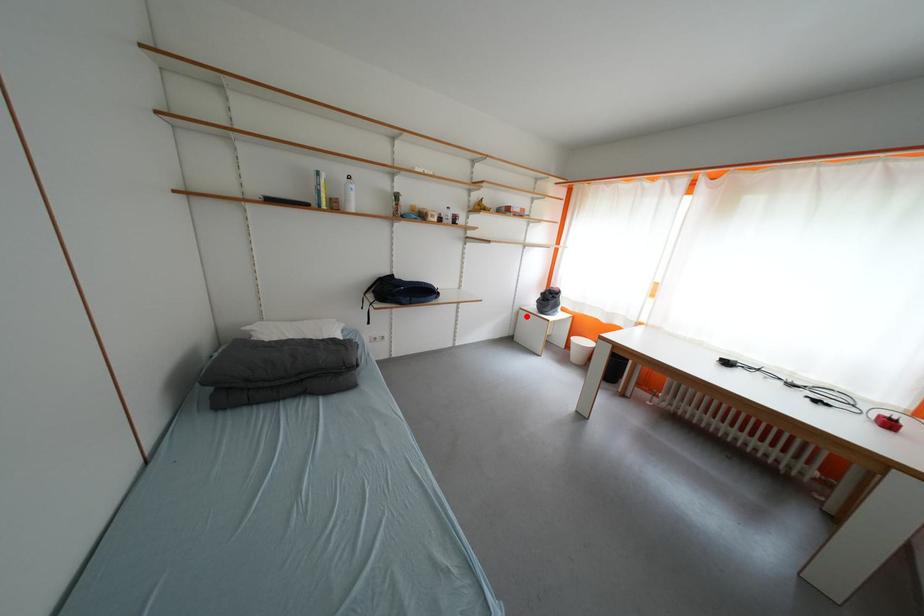
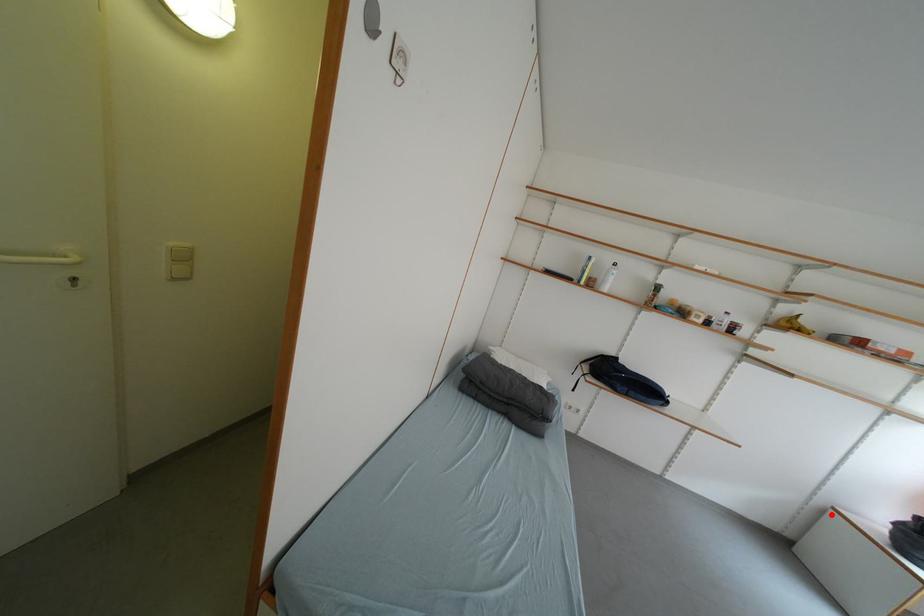
I am providing you with two images of the same scene from different viewpoints. A red point is marked on the first image and another point is marked on the second image. Do the highlighted points in image1 and image2 indicate the same real-world spot?

Yes